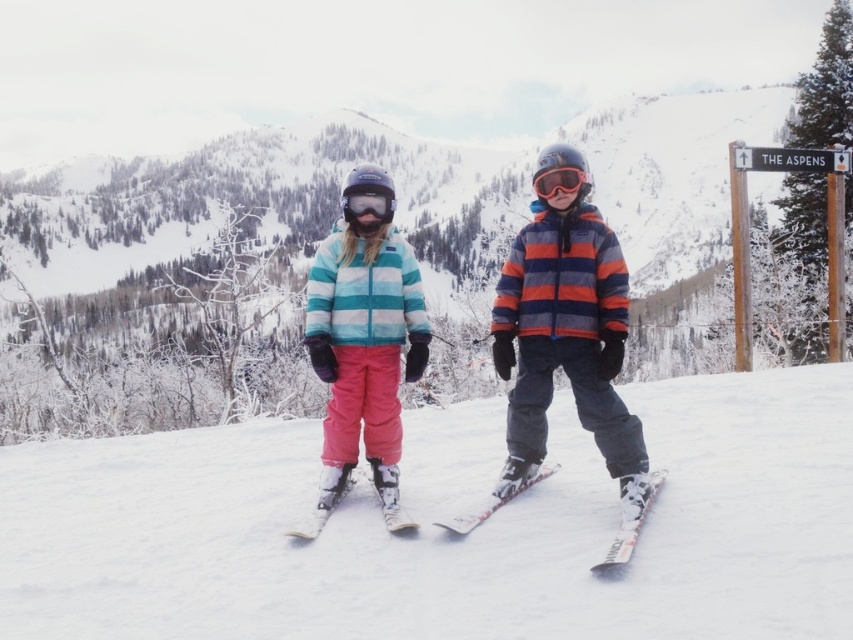
Question: Is the position of pink fabric pants at center less distant than that of white matte ski at center?

Choices:
 (A) yes
 (B) no

Answer: (A)

Question: Estimate the real-world distances between objects in this image. Which object is closer to the white glossy ski at center?

Choices:
 (A) striped fleece jacket at center
 (B) matte black goggles at center
 (C) matte blue striped jacket at center
 (D) matte orange goggles at center

Answer: (A)

Question: Which of these objects is positioned farthest from the pink fabric pants at center?

Choices:
 (A) striped fleece jacket at center
 (B) white matte ski at center
 (C) matte orange goggles at center

Answer: (C)

Question: Observing the image, what is the correct spatial positioning of pink fabric pants at center in reference to striped fleece jacket at center?

Choices:
 (A) below
 (B) above

Answer: (A)

Question: Can you confirm if matte blue striped jacket at center is thinner than white plastic ski at center?

Choices:
 (A) yes
 (B) no

Answer: (B)

Question: Which of these objects is positioned closest to the matte orange goggles at center?

Choices:
 (A) matte black goggles at center
 (B) white matte ski at center

Answer: (A)